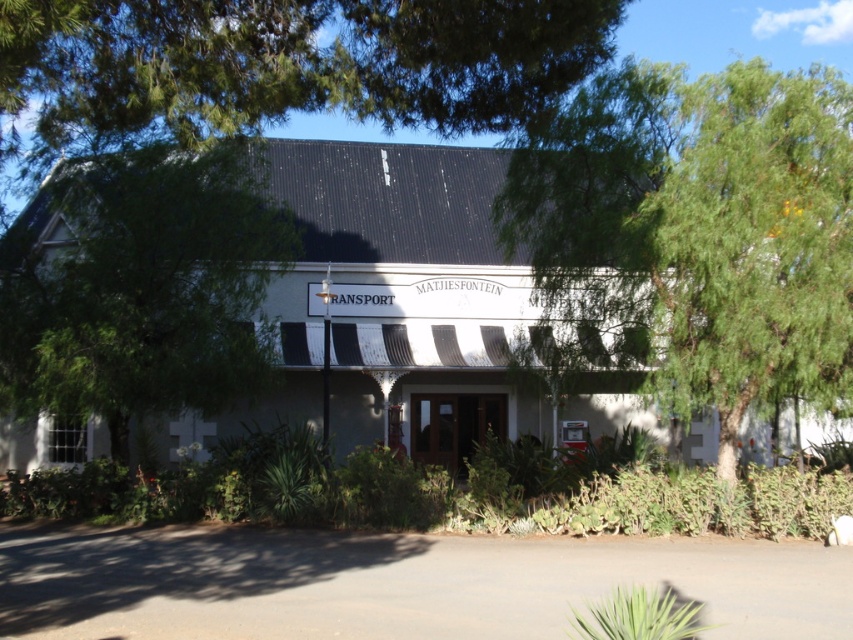
Question: Is green leafy tree at upper right below green leafy tree at upper center?

Choices:
 (A) yes
 (B) no

Answer: (B)

Question: Based on their relative distances, which object is farther from the green leafy tree at upper right?

Choices:
 (A) green leafy tree at upper center
 (B) green leafy tree at left

Answer: (A)

Question: Based on their relative distances, which object is farther from the green leafy tree at upper center?

Choices:
 (A) green leafy tree at upper right
 (B) green leafy tree at left

Answer: (A)

Question: Does green leafy tree at upper center have a lesser width compared to green leafy tree at left?

Choices:
 (A) no
 (B) yes

Answer: (B)

Question: Which point is closer to the camera taking this photo?

Choices:
 (A) (137, 275)
 (B) (199, 8)

Answer: (B)

Question: Where is green leafy tree at upper right located in relation to green leafy tree at upper center in the image?

Choices:
 (A) left
 (B) right

Answer: (B)